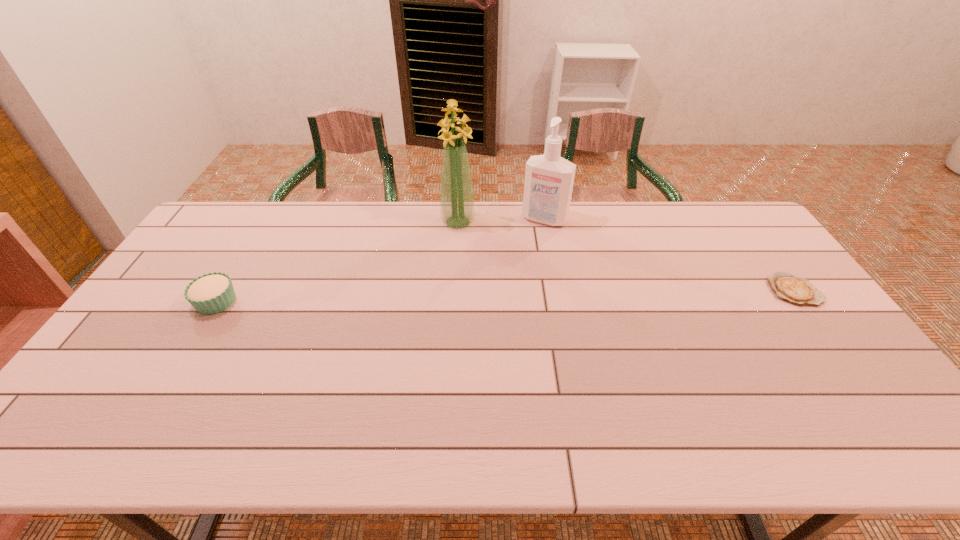
Where is `free space on the desktop that is between the leftmost object and the rightmost object and is positioned on the front label of the third shortest object`? The image size is (960, 540). free space on the desktop that is between the leftmost object and the rightmost object and is positioned on the front label of the third shortest object is located at coordinates (501, 296).

Where is `free space on the desktop that is between the third tallest object and the rightmost object and is positioned on the front-facing side of the bouquet`? free space on the desktop that is between the third tallest object and the rightmost object and is positioned on the front-facing side of the bouquet is located at coordinates (467, 297).